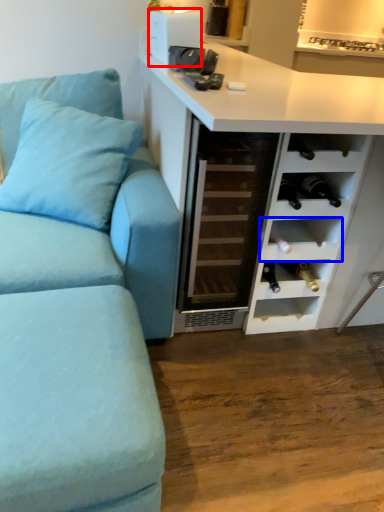
Question: Which of the following is the closest to the observer, appliance (highlighted by a red box) or shelf (highlighted by a blue box)?

Choices:
 (A) appliance
 (B) shelf

Answer: (B)